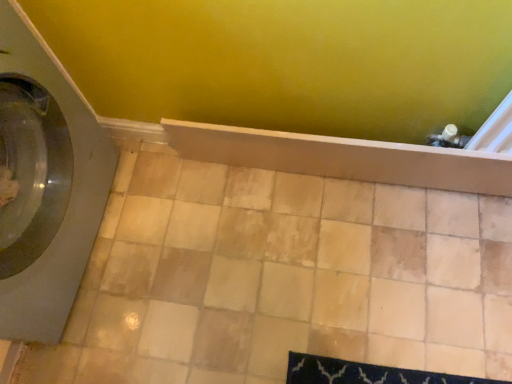
This screenshot has height=384, width=512. What are the coordinates of `free space above beige ceramic tile at center (from a real-world perspective)` in the screenshot? It's located at tap(271, 261).